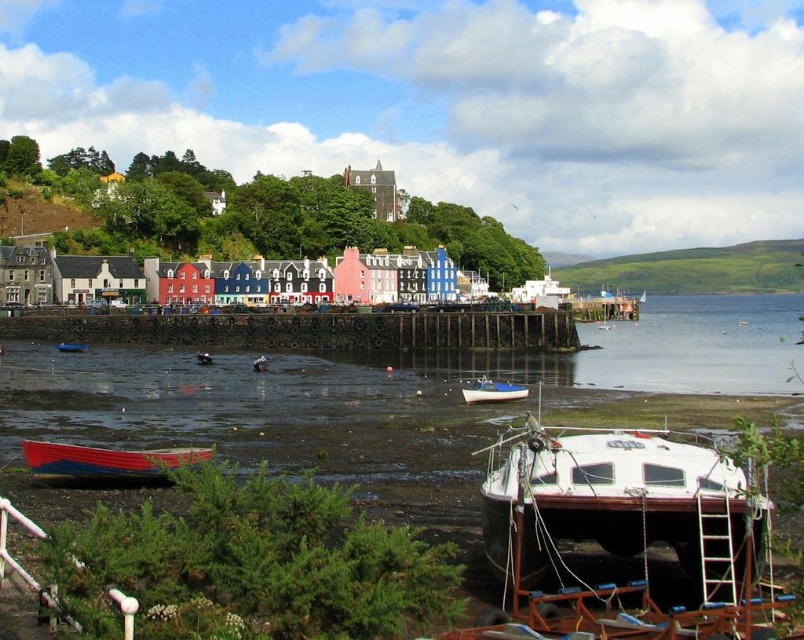
Can you confirm if red wood boat at lower left is positioned to the right of wooden rowboat at lower left?

Correct, you'll find red wood boat at lower left to the right of wooden rowboat at lower left.

Is red wood boat at lower left shorter than wooden rowboat at lower left?

No, red wood boat at lower left is not shorter than wooden rowboat at lower left.

The height and width of the screenshot is (640, 804). I want to click on red wood boat at lower left, so click(x=105, y=464).

Image resolution: width=804 pixels, height=640 pixels. I want to click on red wood boat at lower left, so click(x=105, y=464).

Is white matte boat at lower right above red wood boat at lower left?

Actually, white matte boat at lower right is below red wood boat at lower left.

Which is above, white matte boat at lower right or red wood boat at lower left?

red wood boat at lower left is above.

Is point (608, 433) positioned after point (100, 454)?

Yes, it is behind point (100, 454).

The image size is (804, 640). What are the coordinates of `white matte boat at lower right` in the screenshot? It's located at (606, 497).

Which is more to the left, red wood boat at lower left or blue glossy boat at lower left?

Positioned to the left is blue glossy boat at lower left.

Can you confirm if red wood boat at lower left is positioned to the right of blue glossy boat at lower left?

Indeed, red wood boat at lower left is positioned on the right side of blue glossy boat at lower left.

Is point (117, 476) behind point (60, 349)?

No.

Image resolution: width=804 pixels, height=640 pixels. I want to click on red wood boat at lower left, so click(105, 464).